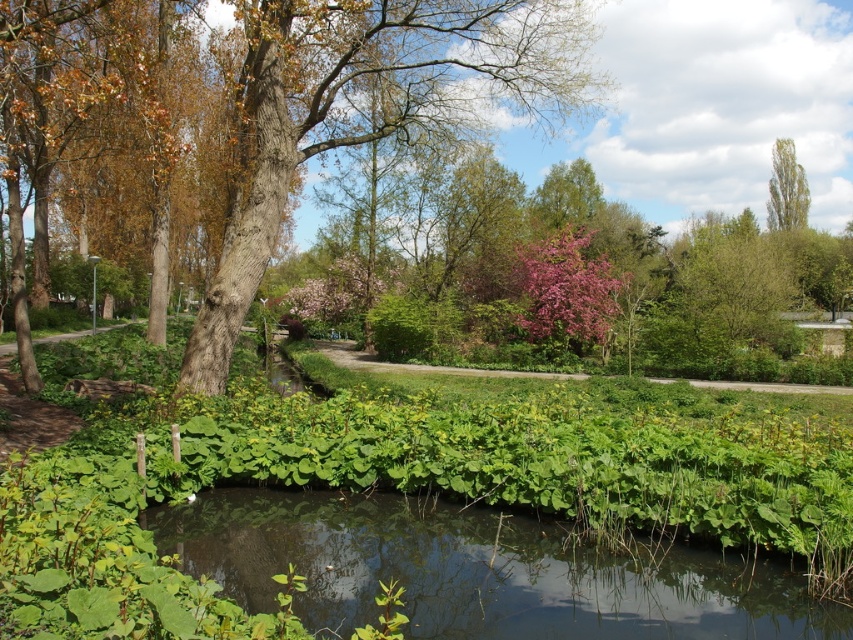
Question: Is green leafy water at center bigger than smooth brown tree trunk at center?

Choices:
 (A) no
 (B) yes

Answer: (A)

Question: Which object is positioned farthest from the green leafy tree at upper right?

Choices:
 (A) green leafy water at center
 (B) smooth brown tree trunk at center

Answer: (A)

Question: Which object appears closest to the camera in this image?

Choices:
 (A) smooth brown tree trunk at center
 (B) green leafy water at center

Answer: (B)

Question: Is green leafy water at center above smooth brown tree trunk at center?

Choices:
 (A) yes
 (B) no

Answer: (B)

Question: Does green leafy water at center have a lesser width compared to green leafy tree at upper right?

Choices:
 (A) no
 (B) yes

Answer: (B)

Question: Among these objects, which one is farthest from the camera?

Choices:
 (A) smooth brown tree trunk at center
 (B) green leafy tree at upper right

Answer: (B)